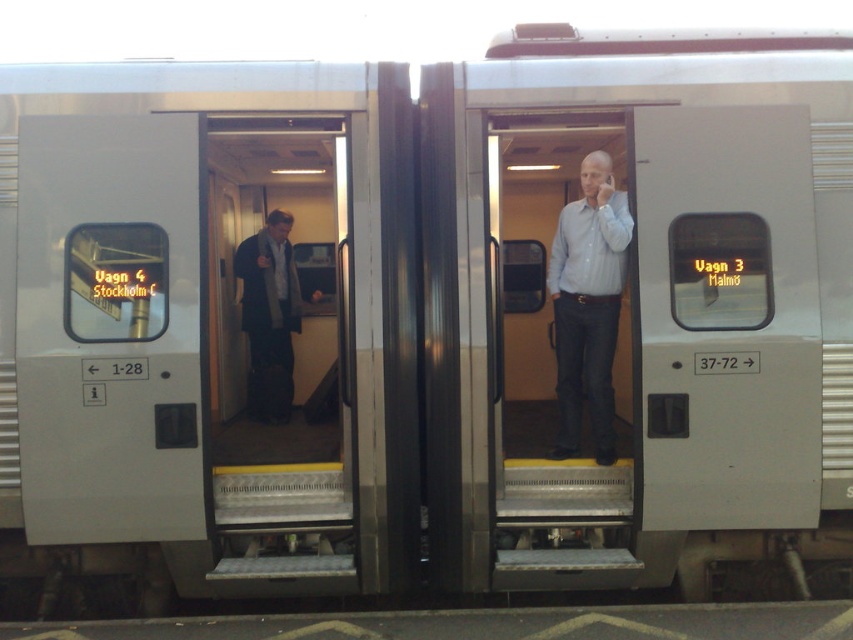
You are standing on a train platform and see the metallic silver door at center and the light blue shirt at center through the open doors. Which object is nearer to you?

The metallic silver door at center is closer to the viewer than the light blue shirt at center.

You are a maintenance worker needing to inspect both doors. You are standing between the metallic gray door at center and the metallic silver door at center. Which door should you move toward first to reach the one closer to you?

Both doors are equidistant from you since they are positioned at the center and you are standing between them. You can choose either door to inspect first.

You are standing outside the train doors and want to know the position of two points inside the train car. Which of the two points, point A at coordinate point [241,173] or point B at coordinate point [613,401], is closer to the back of the train car?

Point A at coordinate point [241,173] is behind point B at coordinate point [613,401], so point A is closer to the back of the train car.